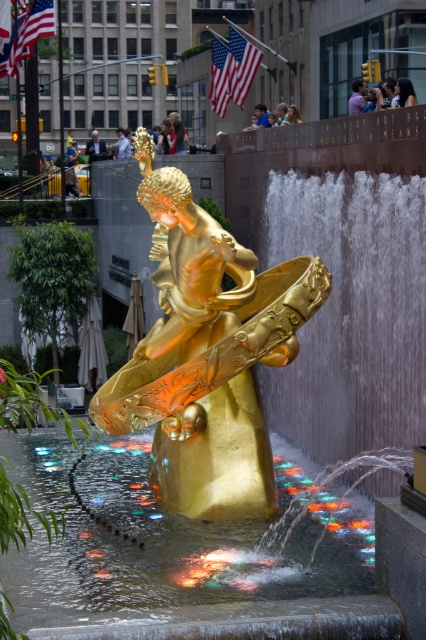
Which is above, translucent glass water at center or gold polished statue at center?

gold polished statue at center is above.

Image resolution: width=426 pixels, height=640 pixels. What do you see at coordinates (187, 554) in the screenshot? I see `translucent glass water at center` at bounding box center [187, 554].

Locate an element on the screen. Image resolution: width=426 pixels, height=640 pixels. translucent glass water at center is located at coordinates (187, 554).